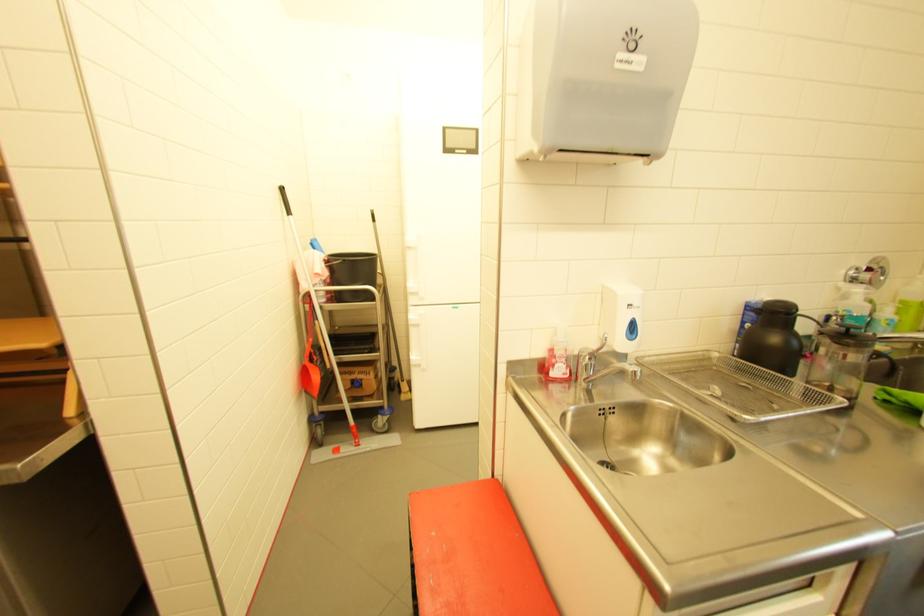
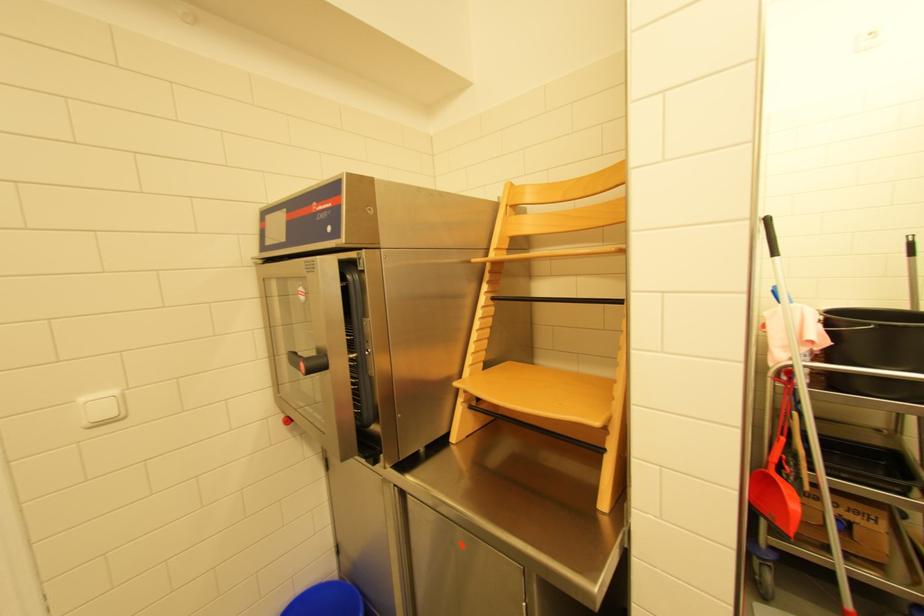
Question: The camera is either moving clockwise (left) or counter-clockwise (right) around the object. The first image is from the beginning of the video and the second image is from the end. Is the camera moving left or right when shooting the video?

Choices:
 (A) Left
 (B) Right

Answer: (B)